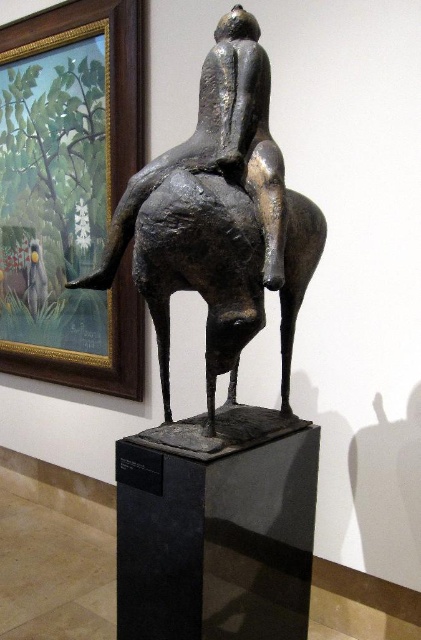
Question: Does gold-framed painting at upper left have a larger size compared to bronze statue at center?

Choices:
 (A) yes
 (B) no

Answer: (A)

Question: Is gold-framed painting at upper left behind bronze statue at center?

Choices:
 (A) yes
 (B) no

Answer: (A)

Question: Among these points, which one is farthest from the camera?

Choices:
 (A) (298, 288)
 (B) (63, 100)

Answer: (B)

Question: Is gold-framed painting at upper left thinner than bronze statue at center?

Choices:
 (A) no
 (B) yes

Answer: (A)